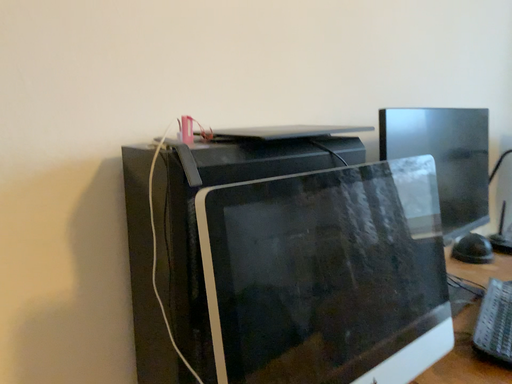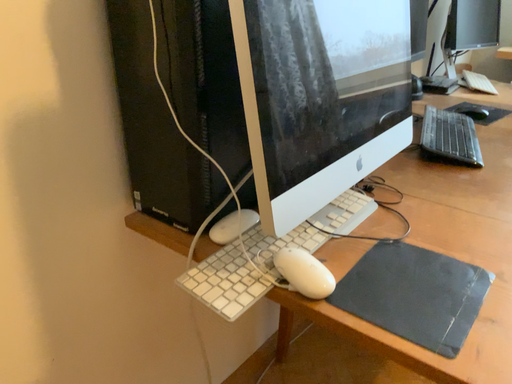
Question: Which way did the camera rotate in the video?

Choices:
 (A) rotated downward
 (B) rotated upward

Answer: (A)